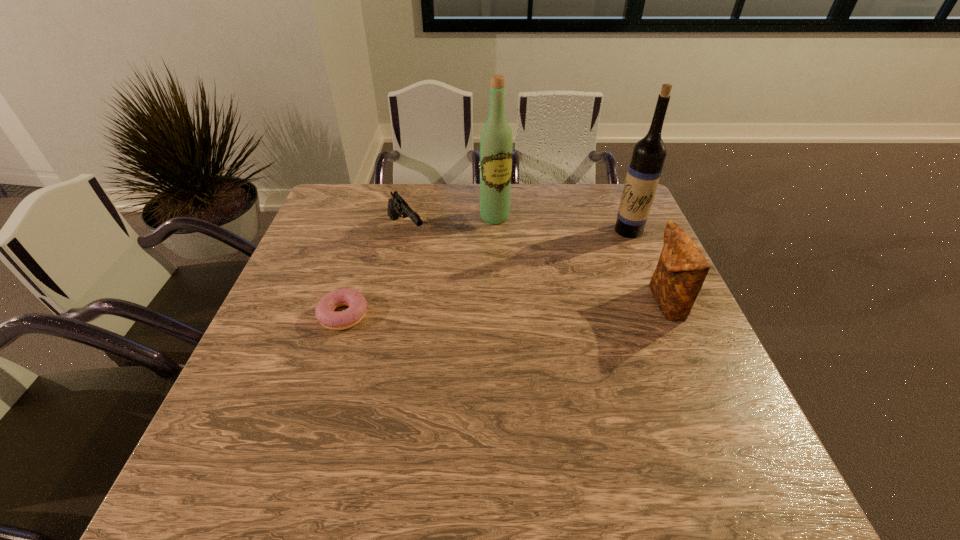
Locate an element on the screen. free region located at the end of the barrel of the gun is located at coordinates (457, 299).

Find the location of a particular element. The height and width of the screenshot is (540, 960). vacant point located at the end of the barrel of the gun is located at coordinates (479, 324).

Locate an element on the screen. vacant area situated on the front-facing side of the left wine bottle is located at coordinates (528, 276).

The height and width of the screenshot is (540, 960). I want to click on free space located 0.230m on the front-facing side of the left wine bottle, so (x=527, y=274).

Locate an element on the screen. This screenshot has height=540, width=960. vacant space located on the front-facing side of the left wine bottle is located at coordinates (546, 307).

The image size is (960, 540). Find the location of `vacant space located 0.060m on the label of the right wine bottle`. vacant space located 0.060m on the label of the right wine bottle is located at coordinates (605, 243).

Where is `vacant space located 0.160m on the label of the right wine bottle`? vacant space located 0.160m on the label of the right wine bottle is located at coordinates (581, 256).

Where is `free point located on the label of the right wine bottle`? Image resolution: width=960 pixels, height=540 pixels. free point located on the label of the right wine bottle is located at coordinates (552, 272).

Where is `gun at the far edge`? The image size is (960, 540). gun at the far edge is located at coordinates (397, 207).

At what (x,y) coordinates should I click in order to perform the action: click on object that is positioned at the left edge. Please return your answer as a coordinate pair (x, y). The width and height of the screenshot is (960, 540). Looking at the image, I should click on (325, 314).